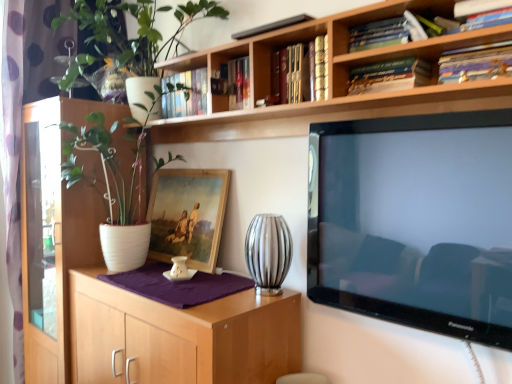
Question: Is hardcover book at upper center, which is the 2th book from right to left, oriented towards wooden bookshelf at upper center?

Choices:
 (A) no
 (B) yes

Answer: (A)

Question: Would you say wooden bookshelf at upper center is part of hardcover book at upper center, the 3th book from the left,'s contents?

Choices:
 (A) yes
 (B) no

Answer: (B)

Question: From a real-world perspective, is hardcover book at upper center, the 3th book from the left, under wooden bookshelf at upper center?

Choices:
 (A) yes
 (B) no

Answer: (A)

Question: Is hardcover book at upper center, the 3th book from the left, positioned far away from wooden bookshelf at upper center?

Choices:
 (A) yes
 (B) no

Answer: (B)

Question: From a real-world perspective, is hardcover book at upper center, which is the 2th book from right to left, on wooden bookshelf at upper center?

Choices:
 (A) no
 (B) yes

Answer: (A)

Question: Is hardcover book at upper center, the 3th book from the left, to the right of wooden bookshelf at upper center from the viewer's perspective?

Choices:
 (A) yes
 (B) no

Answer: (A)

Question: Considering the relative sizes of wooden bookshelf at upper center and hardcover books at upper center, the 3th book viewed from the right, in the image provided, is wooden bookshelf at upper center taller than hardcover books at upper center, the 3th book viewed from the right,?

Choices:
 (A) yes
 (B) no

Answer: (A)

Question: Is wooden bookshelf at upper center to the left of hardcover books at upper center, the 3th book viewed from the right, from the viewer's perspective?

Choices:
 (A) yes
 (B) no

Answer: (A)

Question: Is wooden bookshelf at upper center to the right of hardcover books at upper center, the 3th book viewed from the right, from the viewer's perspective?

Choices:
 (A) no
 (B) yes

Answer: (A)

Question: Is wooden bookshelf at upper center outside of hardcover books at upper center, the 3th book viewed from the right?

Choices:
 (A) no
 (B) yes

Answer: (B)

Question: Is wooden bookshelf at upper center positioned before hardcover books at upper center, which appears as the 2th book when viewed from the left?

Choices:
 (A) yes
 (B) no

Answer: (A)

Question: From a real-world perspective, is wooden bookshelf at upper center on hardcover books at upper center, the 3th book viewed from the right?

Choices:
 (A) no
 (B) yes

Answer: (A)

Question: Can you confirm if white matte pot at upper left is shorter than hardcover books at upper center, which appears as the 2th book when viewed from the left?

Choices:
 (A) no
 (B) yes

Answer: (A)